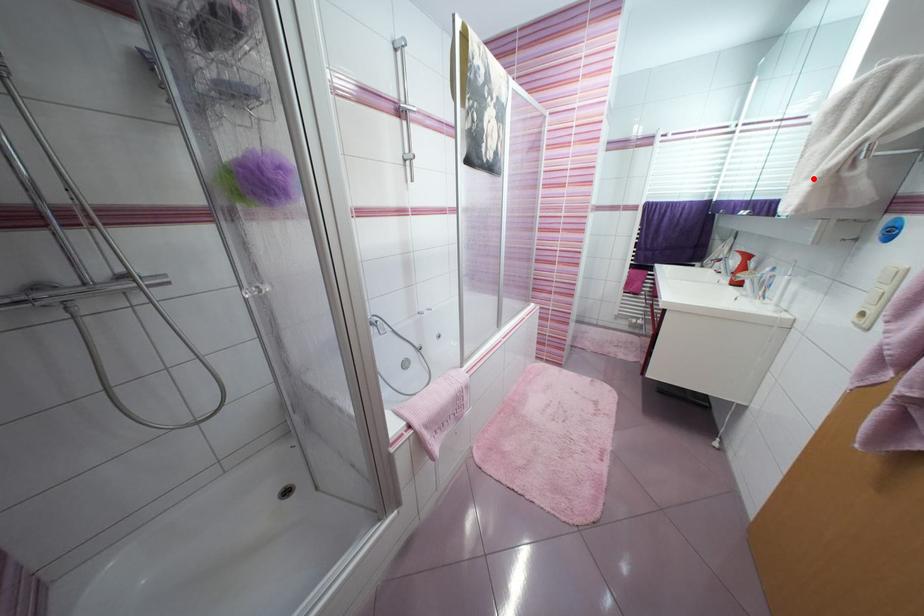
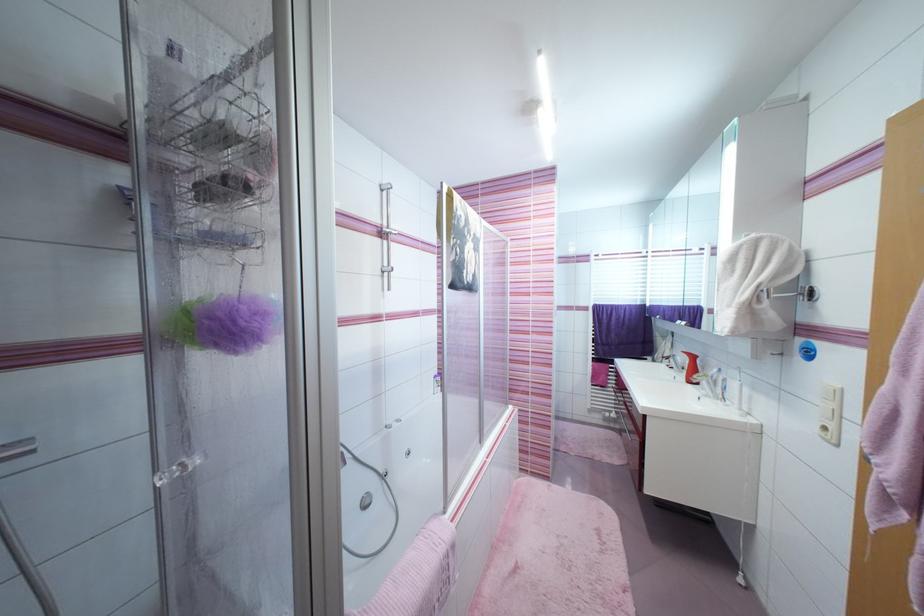
In the second image, find the point that corresponds to the highlighted location in the first image.

(735, 307)